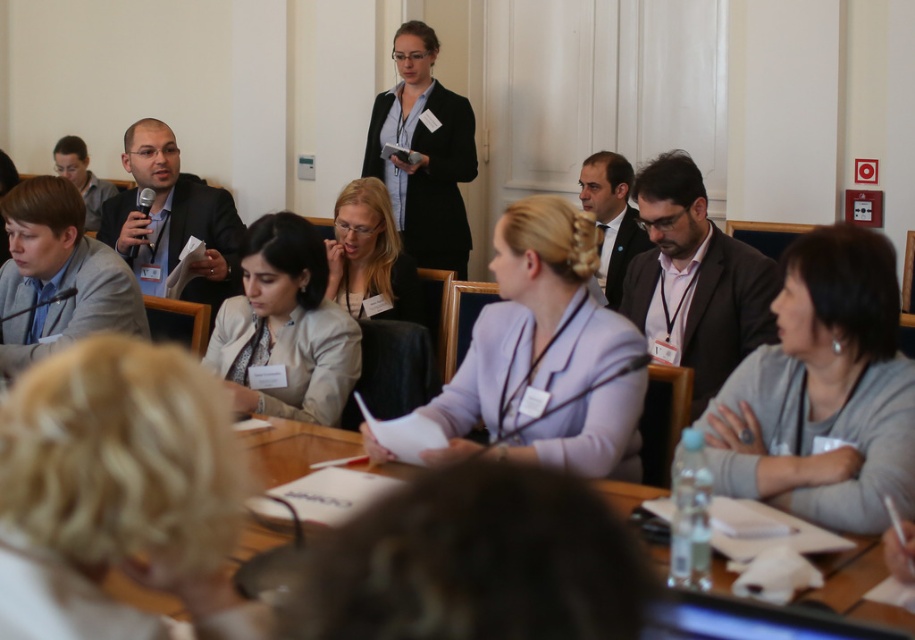
You are an event organizer who needs to arrange seating for the next meeting. You notice the gray sweater at lower right and the matte black jacket at center. Which clothing item is located lower in the image?

The gray sweater at lower right is positioned under the matte black jacket at center, so it is located lower in the image.

You are attending a meeting and want to know if the person with blonde hair at lower left can reach the microphone stand on the table. Considering their height relative to the light beige blazer at center, can they reach it?

The blonde hair at lower left is shorter than the light beige blazer at center. Since the light beige blazer at center is likely worn by someone taller, the person with blonde hair at lower left may not be able to reach the microphone stand easily without assistance.

You are a photographer at the event and want to capture a closeup of the blonde hair at lower left and light beige blazer at center. Which object would require a wider lens to focus on due to its size?

The blonde hair at lower left is thinner than the light beige blazer at center, so the light beige blazer at center requires a wider lens to focus on because it is larger.